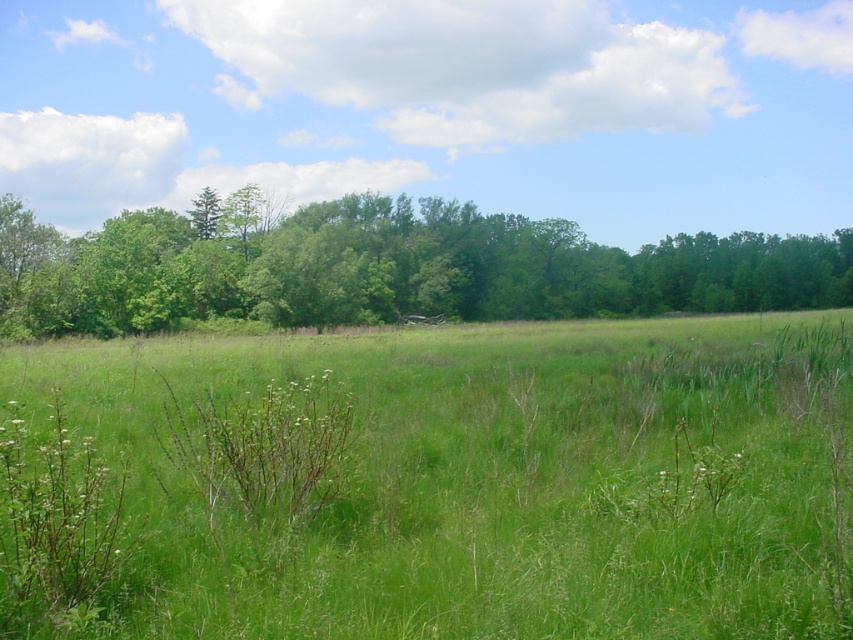
What do you see at coordinates (434, 483) in the screenshot? The image size is (853, 640). I see `green grassy field at center` at bounding box center [434, 483].

Between point (300, 515) and point (442, 248), which one is positioned behind?

Point (442, 248)

Locate an element on the screen. The height and width of the screenshot is (640, 853). green grassy field at center is located at coordinates (434, 483).